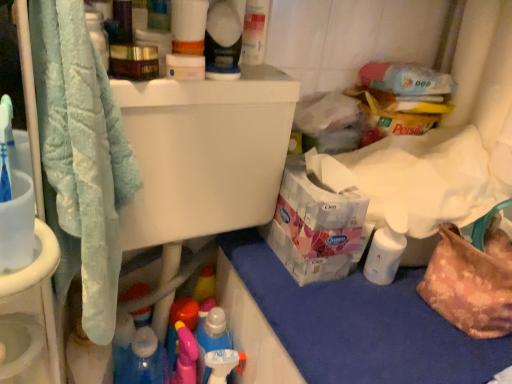
Question: Considering the positions of soft blue towel at left and blue fabric at lower right in the image, is soft blue towel at left bigger or smaller than blue fabric at lower right?

Choices:
 (A) big
 (B) small

Answer: (A)

Question: Relative to blue fabric at lower right, is soft blue towel at left in front or behind?

Choices:
 (A) behind
 (B) front

Answer: (B)

Question: Based on their relative distances, which object is farther from the floral fabric handbag at lower right?

Choices:
 (A) matte white spray bottle at upper center
 (B) soft blue towel at left
 (C) white glossy lotion at lower right
 (D) blue fabric at lower right

Answer: (B)

Question: Considering the real-world distances, which object is closest to the matte white spray bottle at upper center?

Choices:
 (A) floral fabric handbag at lower right
 (B) blue fabric at lower right
 (C) white glossy lotion at lower right
 (D) soft blue towel at left

Answer: (D)